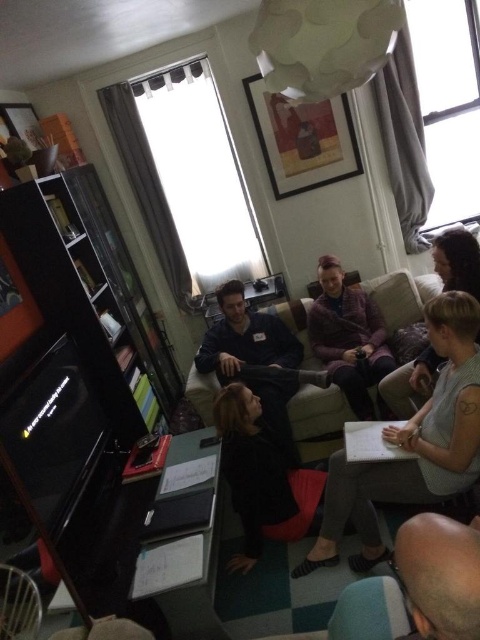
Is light brown textured shirt at right positioned at the back of velvet green armchair at lower center?

Yes, it is behind velvet green armchair at lower center.

Does light brown textured shirt at right appear on the right side of velvet green armchair at lower center?

Yes, light brown textured shirt at right is to the right of velvet green armchair at lower center.

Is point (442, 241) in front of point (407, 625)?

No, it is not.

Locate an element on the screen. light brown textured shirt at right is located at coordinates (457, 260).

Between dark blue fleece jacket at center and velvet beige couch at center, which one is positioned higher?

velvet beige couch at center

Does dark blue fleece jacket at center appear on the right side of velvet beige couch at center?

Indeed, dark blue fleece jacket at center is positioned on the right side of velvet beige couch at center.

Which is in front, point (272, 323) or point (227, 310)?

Point (227, 310) is more forward.

Identify the location of dark blue fleece jacket at center. (244, 339).

Is point (458, 436) positioned after point (395, 385)?

No, (458, 436) is closer to viewer.

Is the position of gray fabric sweater at center more distant than that of light brown textured shirt at right?

That is False.

Describe the element at coordinates (411, 445) in the screenshot. I see `gray fabric sweater at center` at that location.

Where is `gray fabric sweater at center`? The image size is (480, 640). gray fabric sweater at center is located at coordinates (411, 445).